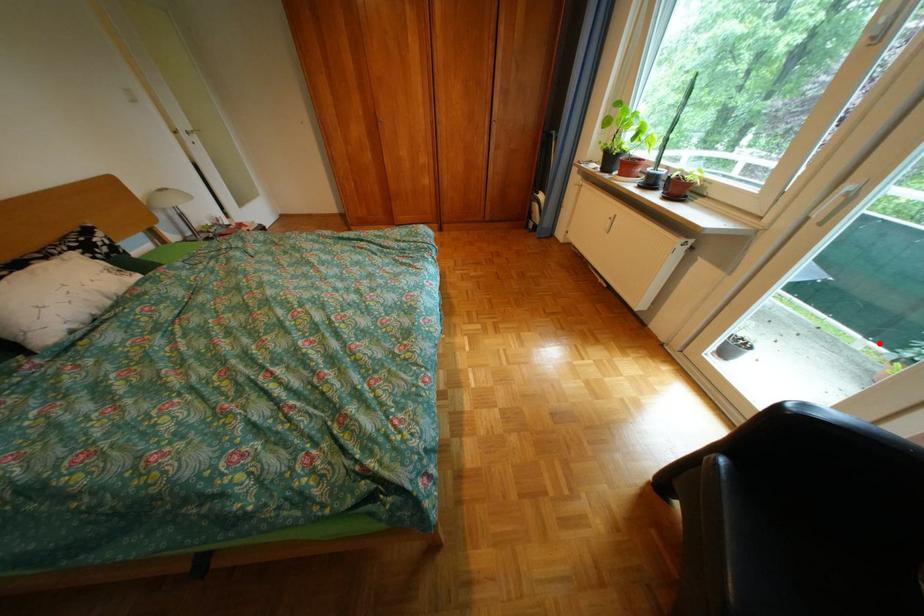
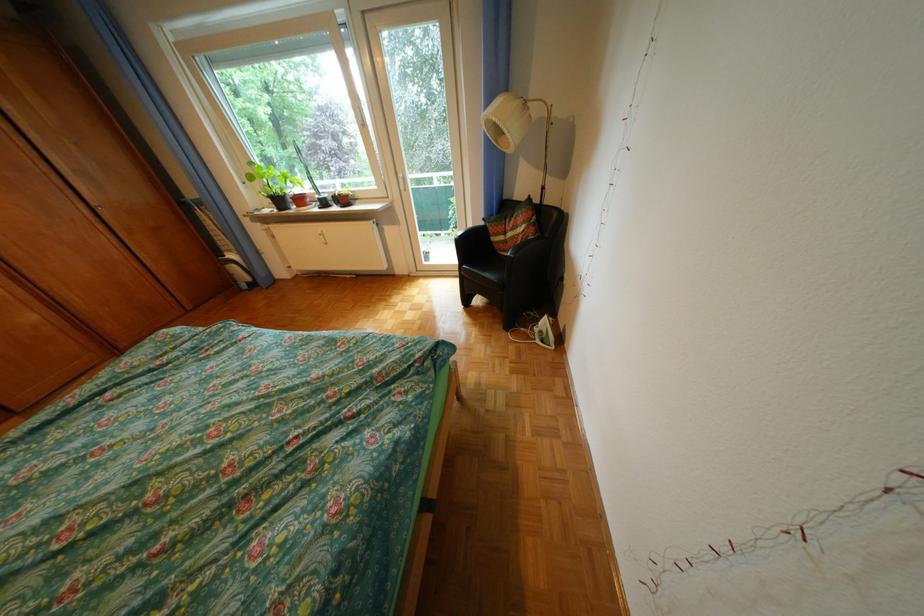
Question: I am providing you with two images of the same scene from different viewpoints. Image1 has a red point marked. In image2, the corresponding 3D location appears at what relative position? Reply with the corresponding letter.

Choices:
 (A) Closer
 (B) Farther

Answer: (B)